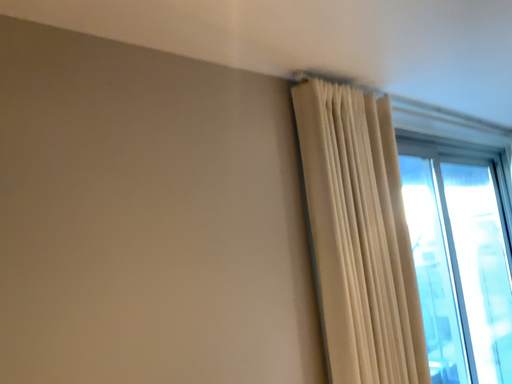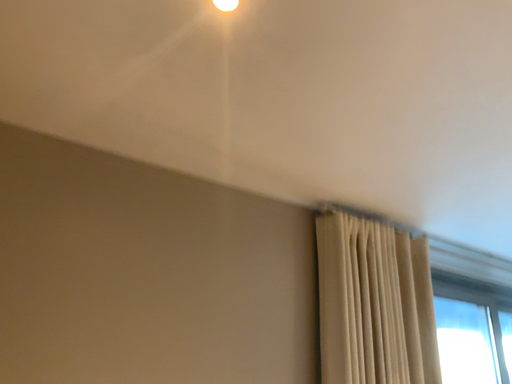
Question: How did the camera likely rotate when shooting the video?

Choices:
 (A) rotated right
 (B) rotated left

Answer: (B)